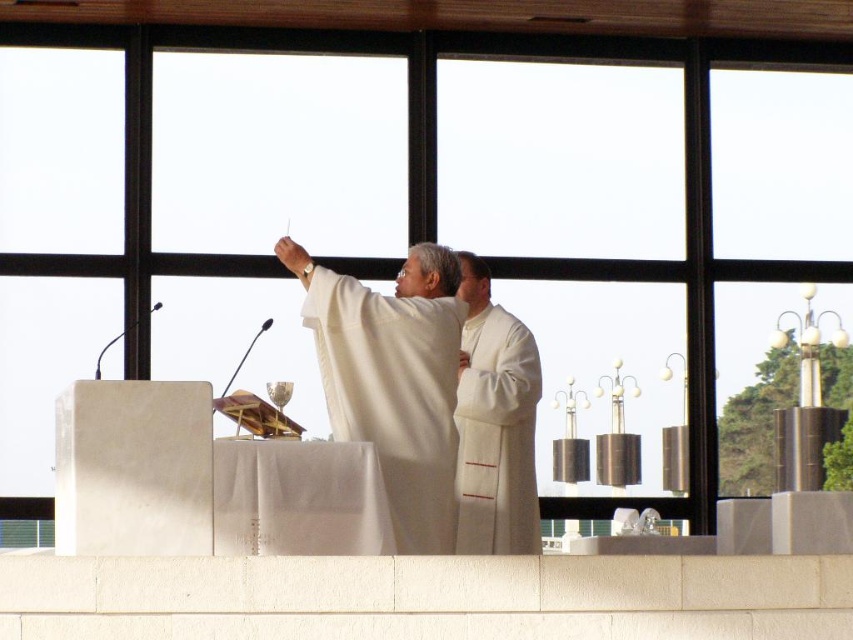
What do you see at coordinates (393, 392) in the screenshot?
I see `white matte robe at center` at bounding box center [393, 392].

Is white matte robe at center smaller than white silk robe at center?

No.

Is point (339, 289) behind point (527, 484)?

That is False.

This screenshot has width=853, height=640. I want to click on white matte robe at center, so click(393, 392).